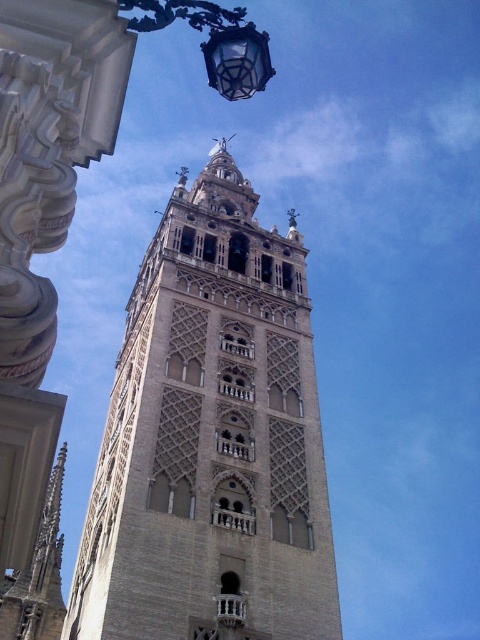
Does beige stone bell tower at center have a larger size compared to clear glass lantern at upper center?

Incorrect, beige stone bell tower at center is not larger than clear glass lantern at upper center.

Is beige stone bell tower at center to the left of clear glass lantern at upper center from the viewer's perspective?

In fact, beige stone bell tower at center is to the right of clear glass lantern at upper center.

Locate an element on the screen. This screenshot has width=480, height=640. beige stone bell tower at center is located at coordinates (211, 440).

Identify the location of beige stone bell tower at center. The height and width of the screenshot is (640, 480). (211, 440).